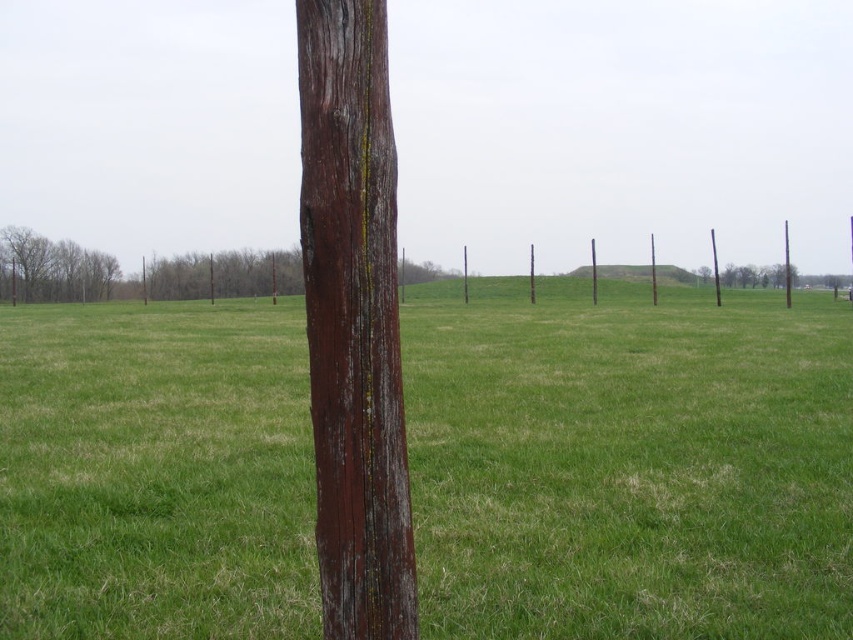
Question: Is smooth brown pole at right further to the viewer compared to brown wooden pole at center?

Choices:
 (A) yes
 (B) no

Answer: (B)

Question: Which object is closer to the camera taking this photo?

Choices:
 (A) brown wooden pole at center
 (B) smooth brown pole at right

Answer: (B)

Question: Which of these objects is positioned closest to the brown wooden pole at center?

Choices:
 (A) weathered wood pole at center
 (B) smooth brown tree trunk at left
 (C) smooth brown pole at center

Answer: (C)

Question: Can you confirm if green grassy field at center is positioned above smooth brown tree trunk at left?

Choices:
 (A) yes
 (B) no

Answer: (B)

Question: Among these objects, which one is nearest to the camera?

Choices:
 (A) smooth brown tree trunk at left
 (B) smooth brown pole at right
 (C) smooth brown pole at center

Answer: (B)

Question: Is green grassy field at center below smooth brown pole at center?

Choices:
 (A) no
 (B) yes

Answer: (B)